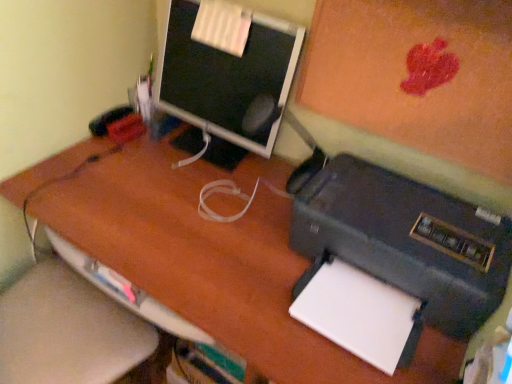
You are a GUI agent. You are given a task and a screenshot of the screen. Output one action in this format:
    pyautogui.click(x=<x>, y=<y>)
    Task: Click on the vacant region above white paper at lower right (from a real-world perspective)
    This screenshot has width=512, height=384.
    Given the screenshot: What is the action you would take?
    pyautogui.click(x=366, y=309)